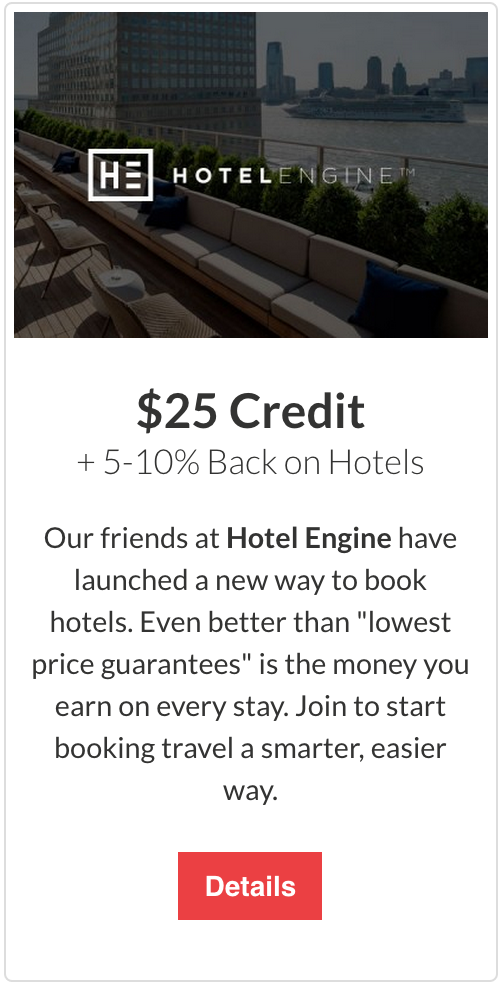
Locate an element on the screen. The image size is (500, 988). window is located at coordinates (183, 67).